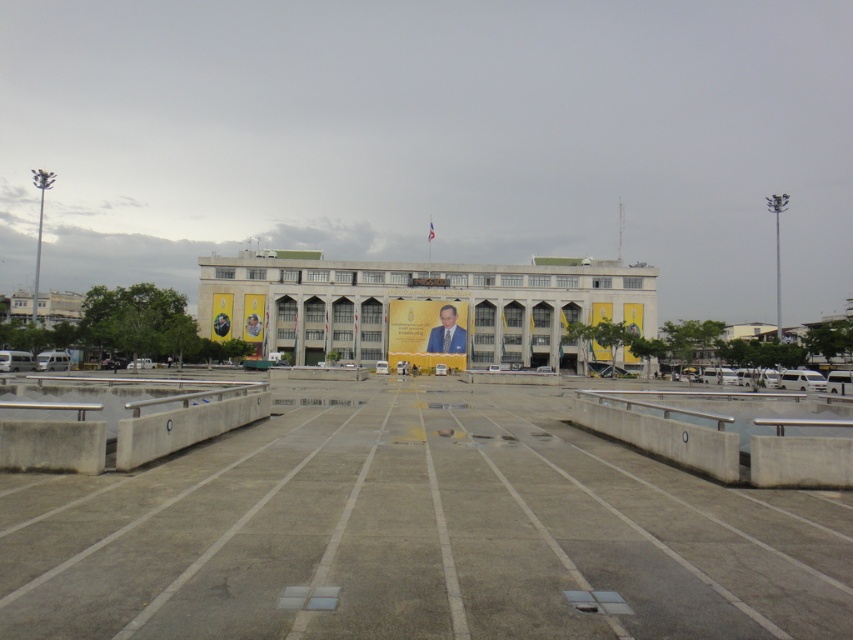
Is concrete at center closer to camera compared to formal suit at center?

Yes.

Identify the location of concrete at center. This screenshot has width=853, height=640. (418, 532).

Describe the element at coordinates (418, 532) in the screenshot. The width and height of the screenshot is (853, 640). I see `concrete at center` at that location.

This screenshot has height=640, width=853. Find the location of `concrete at center`. concrete at center is located at coordinates (418, 532).

Is point (380, 353) positioned behind point (444, 330)?

That is True.

Measure the distance from yellow wall at center to formal suit at center.

A distance of 12.79 meters exists between yellow wall at center and formal suit at center.

Find the location of `yellow wall at center`. yellow wall at center is located at coordinates (416, 305).

Can you confirm if concrete at center is bigger than yellow wall at center?

No.

Image resolution: width=853 pixels, height=640 pixels. What do you see at coordinates (418, 532) in the screenshot?
I see `concrete at center` at bounding box center [418, 532].

You are a GUI agent. You are given a task and a screenshot of the screen. Output one action in this format:
    pyautogui.click(x=<x>, y=<y>)
    Task: Click on the concrete at center
    The image size is (853, 640).
    Given the screenshot: What is the action you would take?
    pyautogui.click(x=418, y=532)